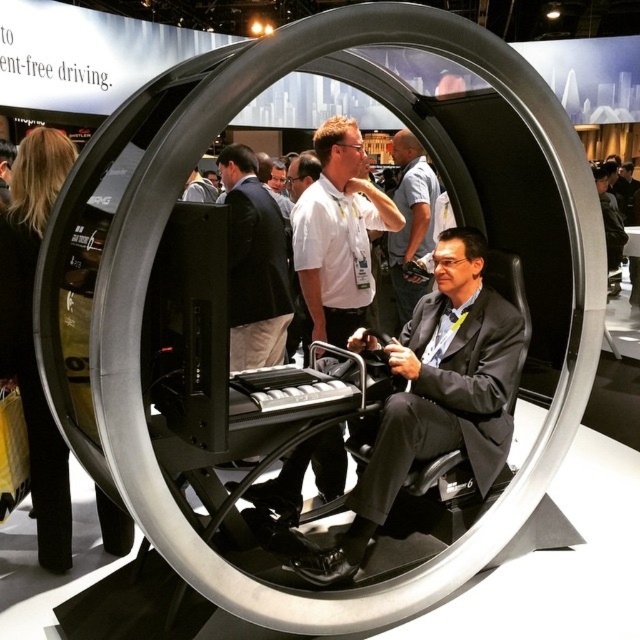
Who is taller, white shirt at center or matte black suit at center?

With more height is white shirt at center.

Does white shirt at center have a lesser height compared to matte black suit at center?

In fact, white shirt at center may be taller than matte black suit at center.

I want to click on white shirt at center, so click(253, 264).

The width and height of the screenshot is (640, 640). In order to click on white shirt at center in this screenshot , I will do `click(253, 264)`.

Measure the distance between light blue shirt at center and matte black suit at center.

light blue shirt at center and matte black suit at center are 9.72 feet apart from each other.

Does point (413, 224) lie in front of point (184, 189)?

Yes, it is in front of point (184, 189).

Identify the location of light blue shirt at center. Image resolution: width=640 pixels, height=640 pixels. (410, 220).

Who is higher up, dark gray suit at center or light blue shirt at center?

Positioned higher is light blue shirt at center.

Can you confirm if dark gray suit at center is positioned above light blue shirt at center?

Incorrect, dark gray suit at center is not positioned above light blue shirt at center.

Which is in front, point (451, 410) or point (436, 186)?

Positioned in front is point (451, 410).

Locate an element on the screen. The width and height of the screenshot is (640, 640). dark gray suit at center is located at coordinates (436, 396).